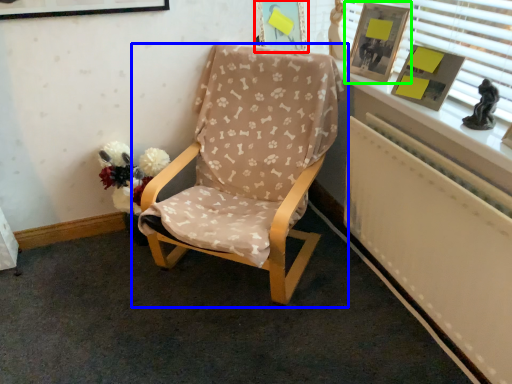
Question: Which object is positioned farthest from picture frame (highlighted by a red box)? Select from chair (highlighted by a blue box) and picture frame (highlighted by a green box).

Choices:
 (A) chair
 (B) picture frame

Answer: (A)